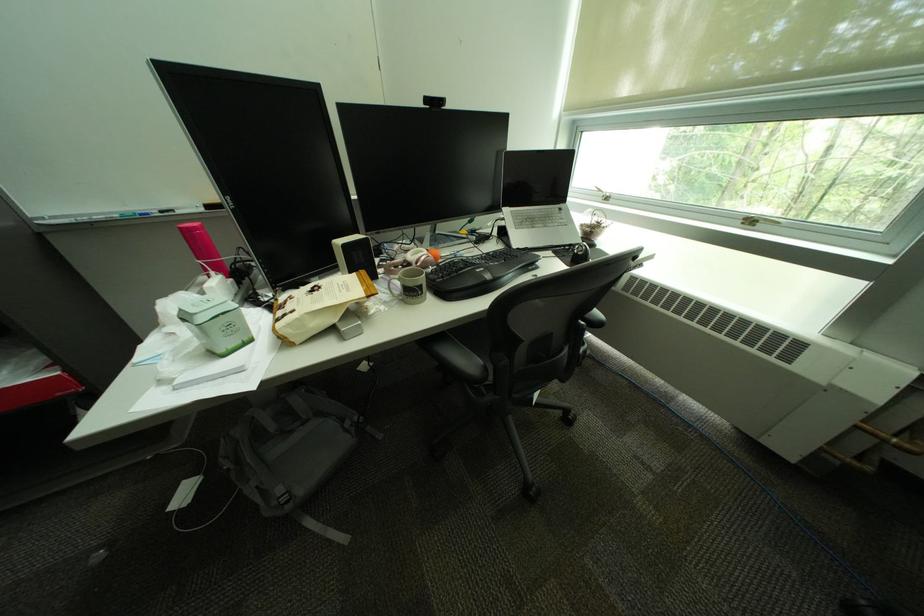
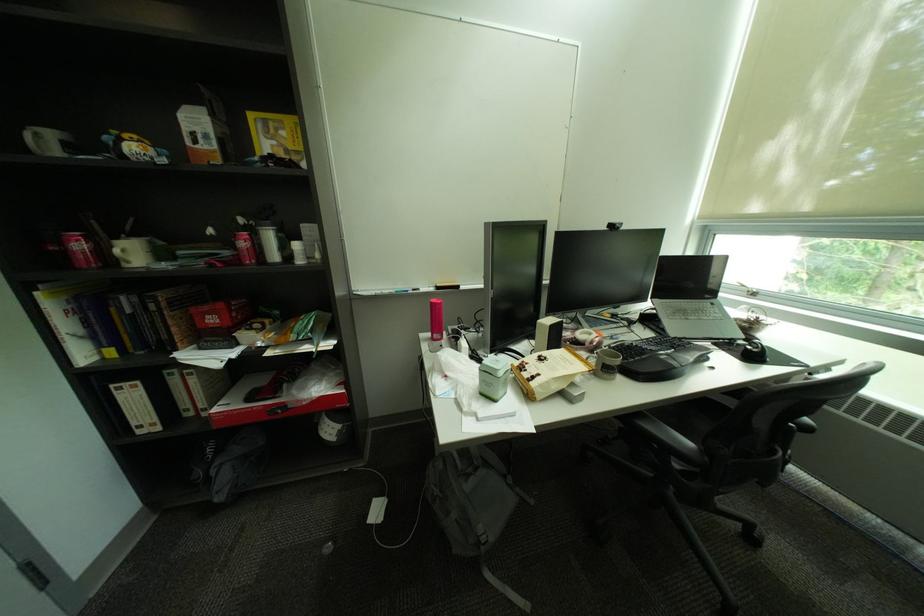
Where in the second image is the point corresponding to (590,254) from the first image?

(766, 352)